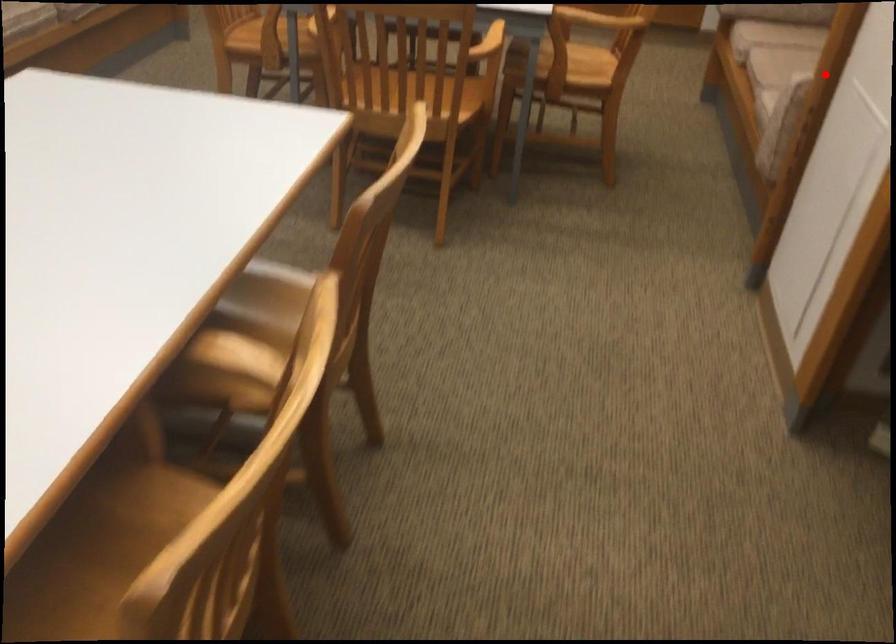
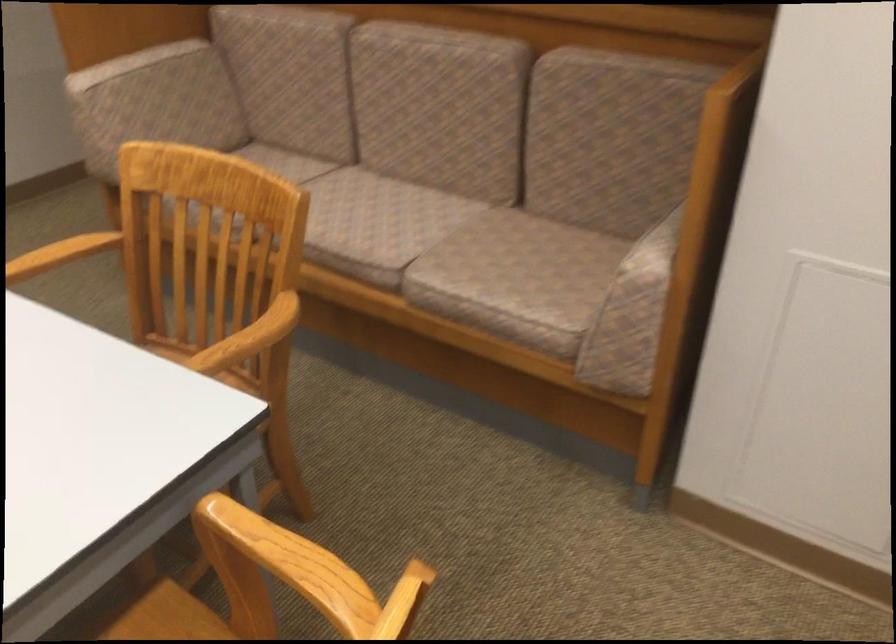
Find the pixel in the second image that matches the highlighted location in the first image.

(655, 248)